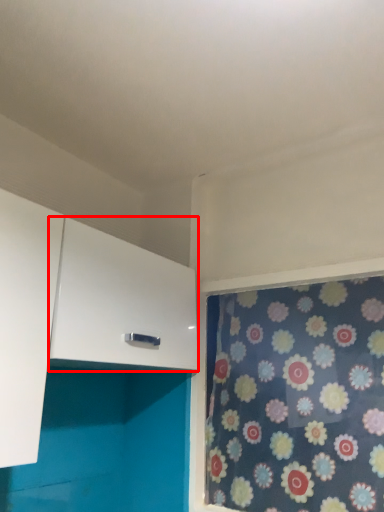
Question: Where is cabinetry (annotated by the red box) located in relation to curtain in the image?

Choices:
 (A) left
 (B) right

Answer: (A)